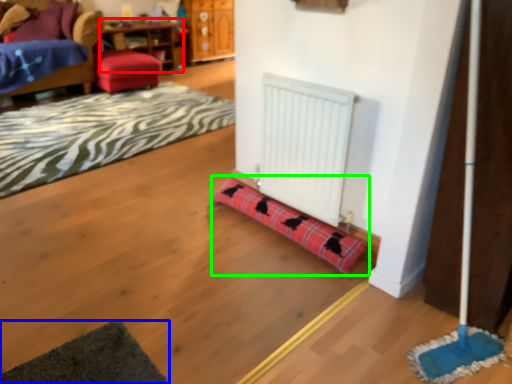
Question: Which object is the closest to the table (highlighted by a red box)? Choose among these: yoga mat (highlighted by a blue box) or plaid (highlighted by a green box).

Choices:
 (A) yoga mat
 (B) plaid

Answer: (B)